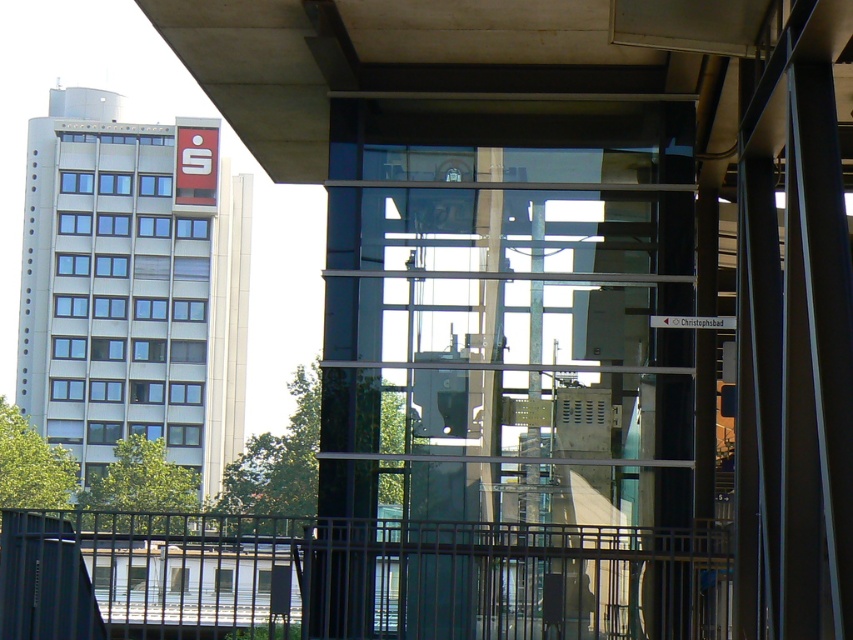
Between transparent glass elevator at center and metallic gray rail at lower center, which one appears on the left side from the viewer's perspective?

metallic gray rail at lower center is more to the left.

Can you confirm if transparent glass elevator at center is wider than metallic gray rail at lower center?

No.

Locate an element on the screen. transparent glass elevator at center is located at coordinates (508, 372).

From the picture: Does concrete ceiling at upper center have a greater height compared to metallic gray rail at lower center?

Incorrect, concrete ceiling at upper center's height is not larger of metallic gray rail at lower center's.

Is point (639, 102) positioned in front of point (335, 628)?

No, it is not.

The height and width of the screenshot is (640, 853). What are the coordinates of `concrete ceiling at upper center` in the screenshot? It's located at (523, 76).

Does transparent glass elevator at center lie in front of concrete ceiling at upper center?

No, it is behind concrete ceiling at upper center.

Is point (486, 577) positioned before point (265, 106)?

Yes, it is.

Locate an element on the screen. This screenshot has width=853, height=640. transparent glass elevator at center is located at coordinates (508, 372).